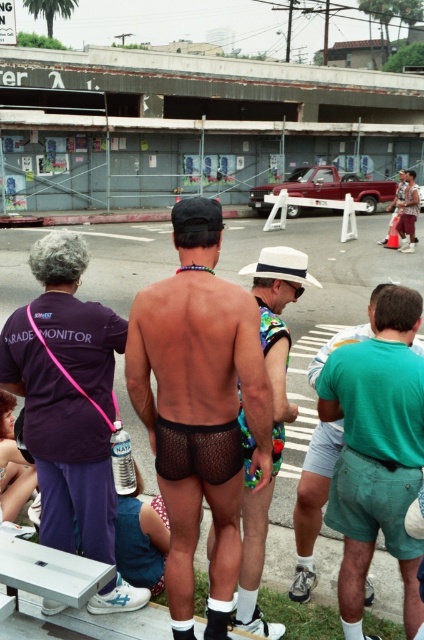
Can you confirm if black mesh underwear at center is shorter than fishnet shorts at center?

Indeed, black mesh underwear at center has a lesser height compared to fishnet shorts at center.

Between black mesh underwear at center and fishnet shorts at center, which one has less height?

black mesh underwear at center

Is point (66, 307) closer to camera compared to point (276, 380)?

That is False.

You are a GUI agent. You are given a task and a screenshot of the screen. Output one action in this format:
    pyautogui.click(x=<x>, y=<y>)
    Task: Click on the black mesh underwear at center
    The height and width of the screenshot is (640, 424).
    Given the screenshot: What is the action you would take?
    pyautogui.click(x=61, y=445)

Can you confirm if black mesh underwear at center is positioned to the right of white plastic picnic table at lower left?

Correct, you'll find black mesh underwear at center to the right of white plastic picnic table at lower left.

Is the position of black mesh underwear at center more distant than that of white plastic picnic table at lower left?

Yes, it is behind white plastic picnic table at lower left.

You are a GUI agent. You are given a task and a screenshot of the screen. Output one action in this format:
    pyautogui.click(x=<x>, y=<y>)
    Task: Click on the black mesh underwear at center
    
    Given the screenshot: What is the action you would take?
    pyautogui.click(x=61, y=445)

Locate an element on the screen. This screenshot has width=424, height=640. black mesh underwear at center is located at coordinates (61, 445).

Between fishnet shorts at center and green fabric shorts at lower right, which one appears on the left side from the viewer's perspective?

Positioned to the left is fishnet shorts at center.

Which of these two, fishnet shorts at center or green fabric shorts at lower right, stands taller?

Standing taller between the two is fishnet shorts at center.

Who is more forward, (265, 272) or (320, 496)?

Point (265, 272)

Find the location of `fishnet shorts at center`. fishnet shorts at center is located at coordinates (273, 420).